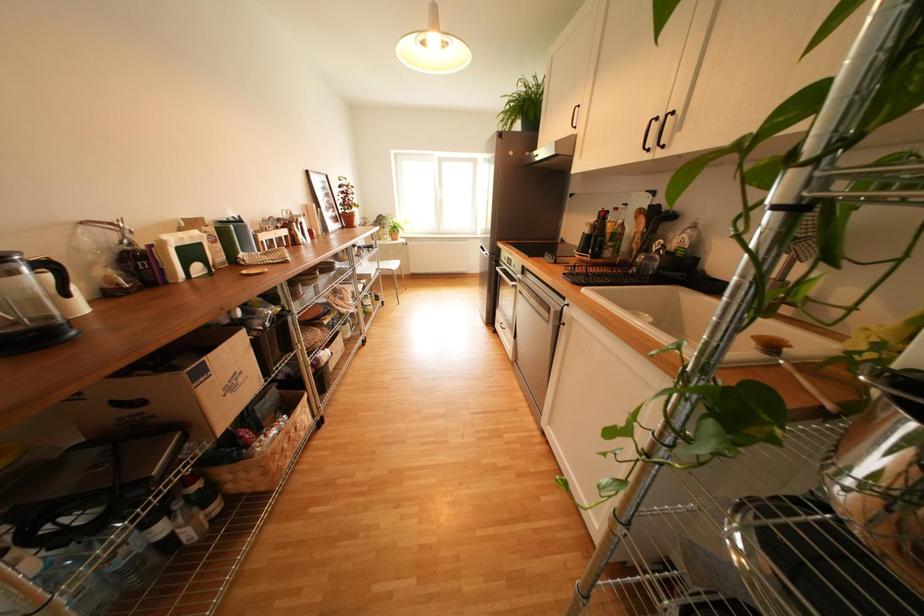
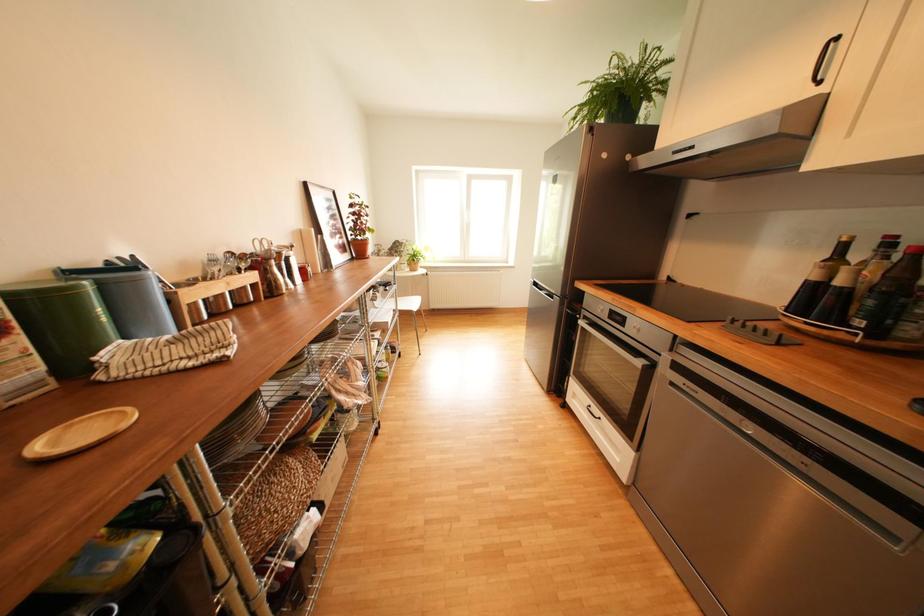
What movement of the cameraman would produce the second image?

The cameraman moved toward left, forward.